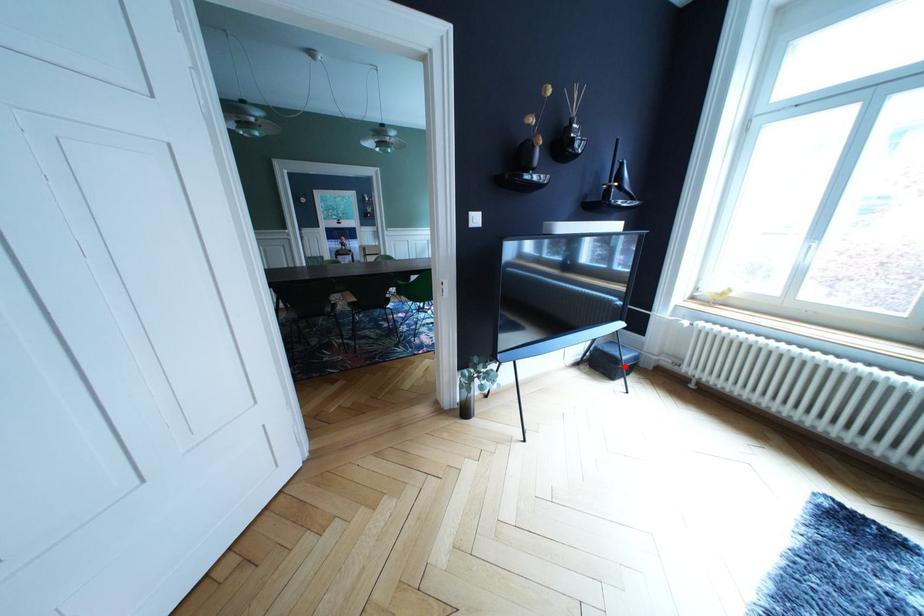
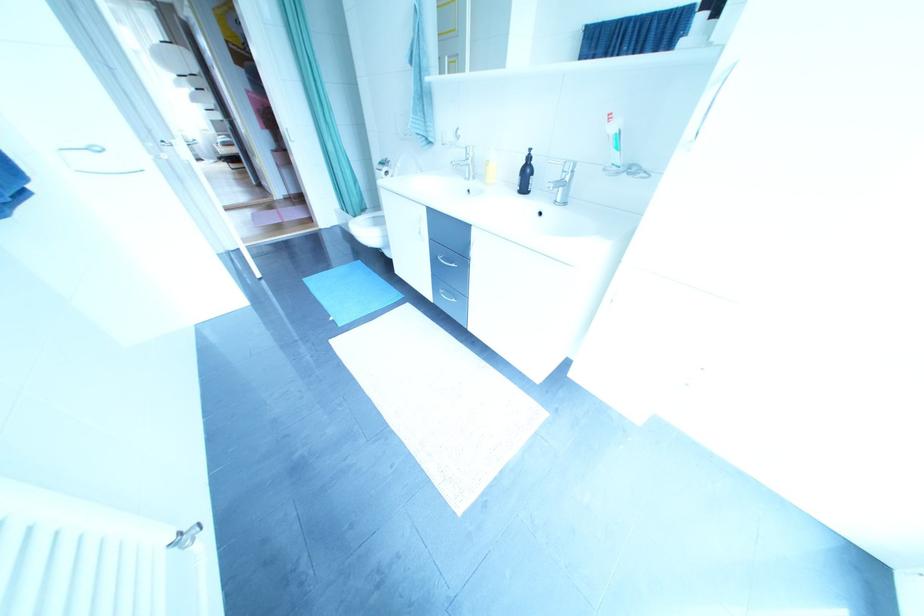
Question: I am providing you with two images of the same scene from different viewpoints. A red point is marked on the first image. At the location where the point appears in image 1, is it still visible in image 2?

Choices:
 (A) Yes
 (B) No

Answer: (B)